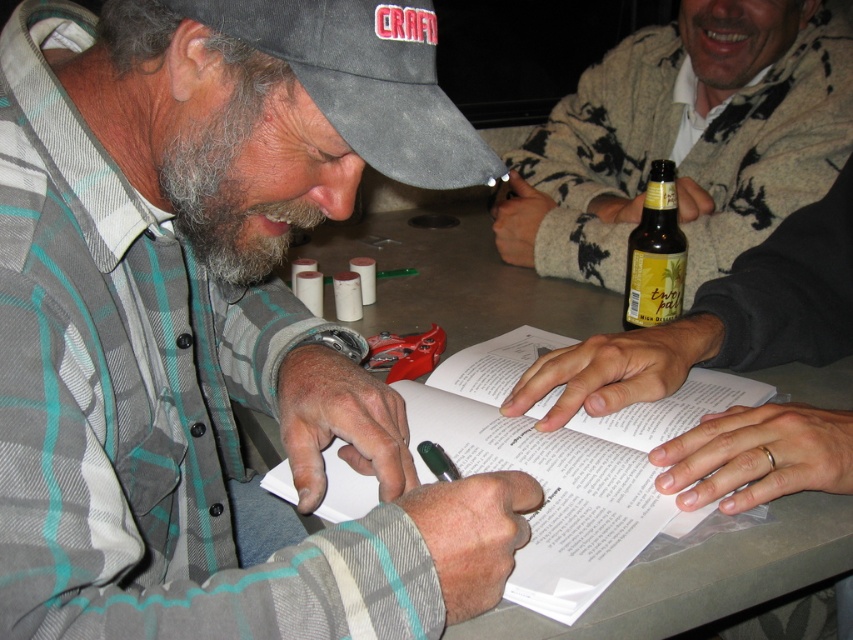
Is black fabric baseball cap at upper left to the left of brown glass bottle at center from the viewer's perspective?

Yes, black fabric baseball cap at upper left is to the left of brown glass bottle at center.

Is point (412, 104) positioned in front of point (631, 262)?

Yes.

The height and width of the screenshot is (640, 853). Find the location of `black fabric baseball cap at upper left`. black fabric baseball cap at upper left is located at coordinates (364, 80).

Between plaid flannel shirt at center and brown glass bottle at center, which one appears on the right side from the viewer's perspective?

brown glass bottle at center

Image resolution: width=853 pixels, height=640 pixels. Describe the element at coordinates (213, 323) in the screenshot. I see `plaid flannel shirt at center` at that location.

The height and width of the screenshot is (640, 853). In order to click on plaid flannel shirt at center in this screenshot , I will do `click(213, 323)`.

Does matte brown paper at center come behind brown glass bottle at center?

No, matte brown paper at center is in front of brown glass bottle at center.

Is point (622, 404) positioned after point (660, 198)?

No.

At what (x,y) coordinates should I click in order to perform the action: click on matte brown paper at center. Please return your answer as a coordinate pair (x, y). Looking at the image, I should click on (718, 321).